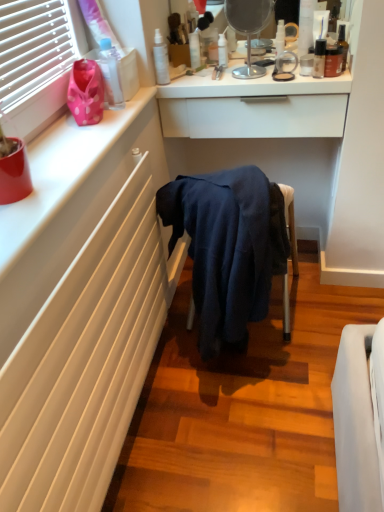
At what (x,y) coordinates should I click in order to perform the action: click on empty space that is in between satin white spray bottle at upper center, marked as the seventh toiletry in a right-to-left arrangement, and translucent plastic spray bottle at upper center, arranged as the fourth toiletry when viewed from the left. Please return your answer as a coordinate pair (x, y). Image resolution: width=384 pixels, height=512 pixels. Looking at the image, I should click on 192,76.